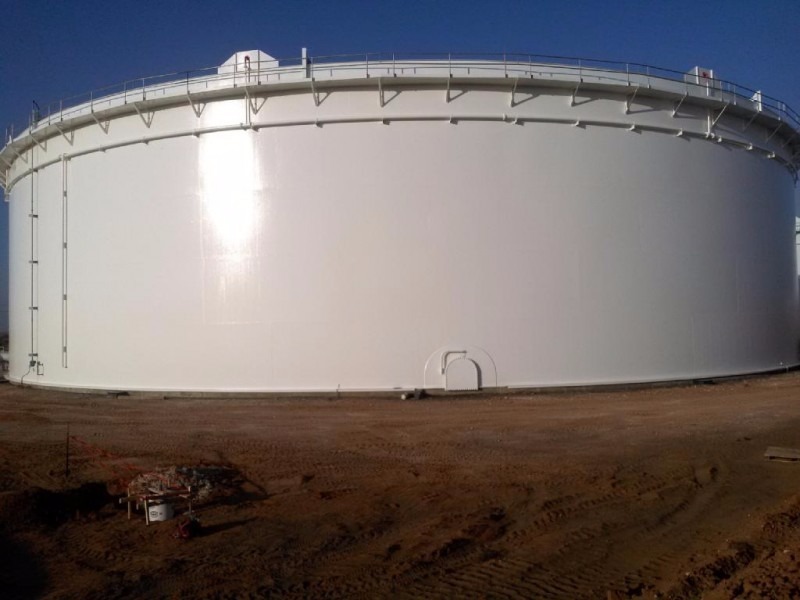
Find the location of a particular element. tiny door is located at coordinates (469, 377).